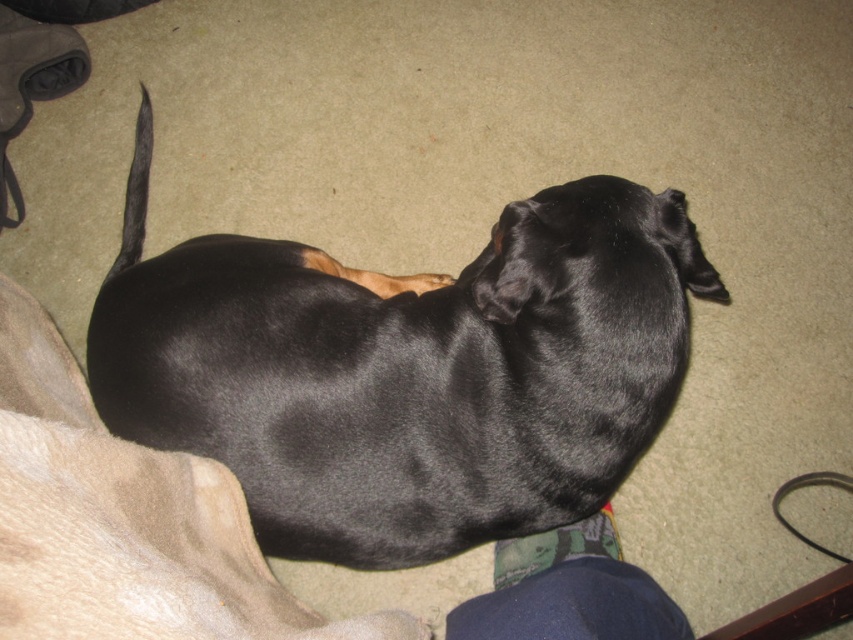
You are taking a photo of the black dog and want to focus on the point closest to the camera. Which point should you choose between point [480,490] and point [788,492]?

Point [480,490] is closer to the camera than point [788,492], so you should choose point [480,490] to focus on the point closest to the camera.

You are a pet owner who wants to attach a leash to your dog. Based on the scene, can you determine if the black rubber leash at lower right is within reach of the shiny black dog at center?

The shiny black dog at center is in front of the black rubber leash at lower right, so the leash is behind the dog. Since the dog is lying on its side with its front legs extended forward, it might be able to reach the leash if it moves slightly forward or stretches its neck. However, the exact distance isn